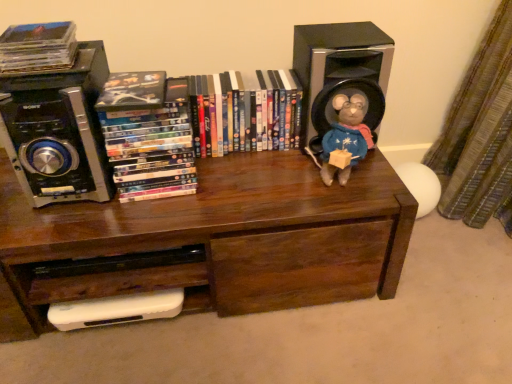
The width and height of the screenshot is (512, 384). In order to click on free space between fuzzy fabric stuffed animal at upper right and matte plastic dvds at left, positioned as the second book in left-to-right order in this screenshot , I will do `click(253, 176)`.